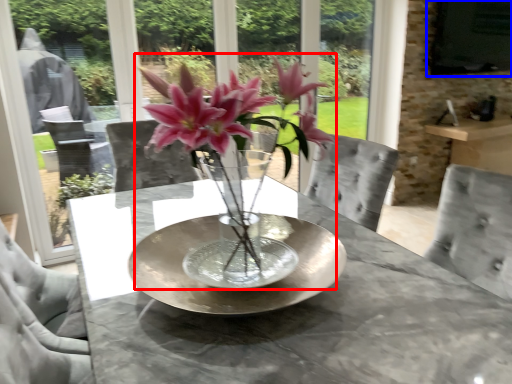
Question: Which of the following is the closest to the observer, houseplant (highlighted by a red box) or window screen (highlighted by a blue box)?

Choices:
 (A) houseplant
 (B) window screen

Answer: (A)